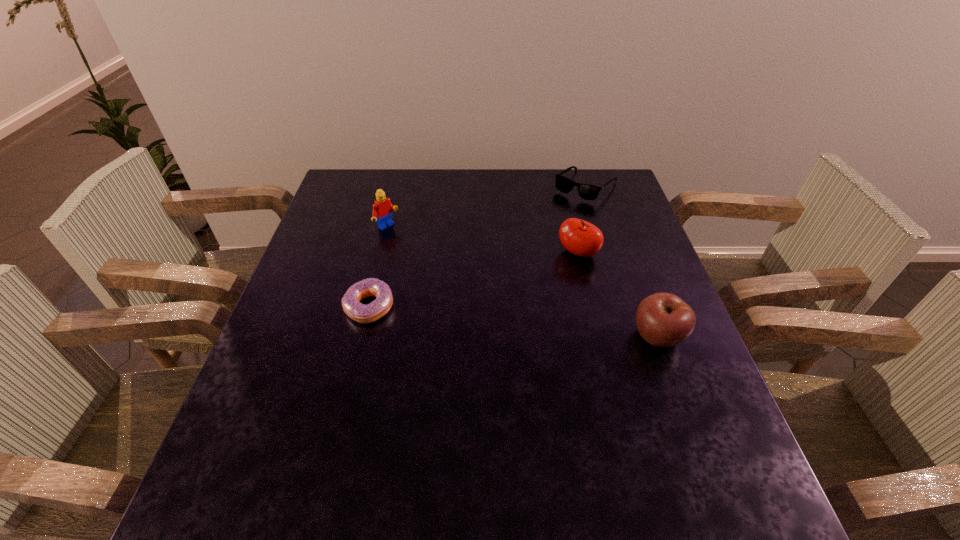
Locate an element on the screen. The height and width of the screenshot is (540, 960). free space located 0.320m on the stem of the third farthest object is located at coordinates (476, 327).

Image resolution: width=960 pixels, height=540 pixels. Identify the location of blank area located on the stem of the third farthest object. (526, 290).

The height and width of the screenshot is (540, 960). Find the location of `blank space located 0.400m on the front-facing side of the Lego`. blank space located 0.400m on the front-facing side of the Lego is located at coordinates (495, 308).

Find the location of `vacant space located on the front-facing side of the Lego`. vacant space located on the front-facing side of the Lego is located at coordinates (478, 295).

Where is `vacant space located 0.260m on the front-facing side of the Lego`? vacant space located 0.260m on the front-facing side of the Lego is located at coordinates (456, 279).

This screenshot has height=540, width=960. What are the coordinates of `free location located on the front-facing side of the farthest object` in the screenshot? It's located at (509, 278).

This screenshot has height=540, width=960. Find the location of `vacant space located on the front-facing side of the farthest object`. vacant space located on the front-facing side of the farthest object is located at coordinates (553, 224).

I want to click on vacant space located 0.260m on the front-facing side of the farthest object, so click(534, 247).

Image resolution: width=960 pixels, height=540 pixels. Find the location of `object present at the far edge`. object present at the far edge is located at coordinates (586, 191).

Find the location of a particular element. doughnut that is at the left edge is located at coordinates (359, 312).